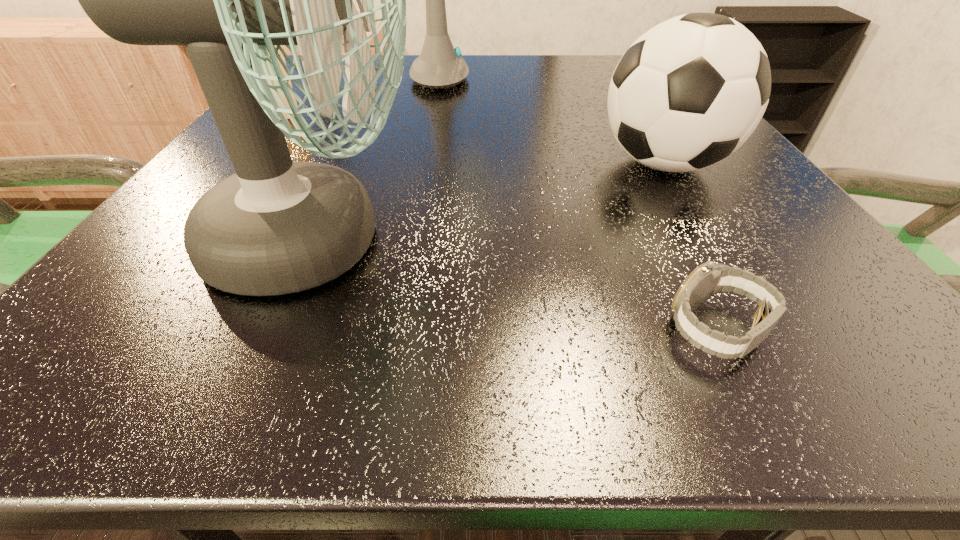
This screenshot has height=540, width=960. Identify the location of object at the near left corner. (276, 227).

Image resolution: width=960 pixels, height=540 pixels. I want to click on object that is at the near right corner, so click(709, 278).

In the image, there is a desktop. At what (x,y) coordinates should I click in order to perform the action: click on vacant space at the far edge. Please return your answer as a coordinate pair (x, y). This screenshot has height=540, width=960. Looking at the image, I should click on (567, 77).

Where is `vacant space at the near edge of the desktop`? vacant space at the near edge of the desktop is located at coordinates (708, 379).

What are the coordinates of `vacant space at the left edge of the desktop` in the screenshot? It's located at (309, 106).

The height and width of the screenshot is (540, 960). In the image, there is a desktop. Identify the location of vacant space at the near left corner. (132, 347).

Locate an element on the screen. This screenshot has width=960, height=540. free space at the near right corner of the desktop is located at coordinates (900, 338).

Find the location of a particular element. The height and width of the screenshot is (540, 960). vacant space that's between the watch and the farthest object is located at coordinates (584, 205).

Locate an element on the screen. vacant area that lies between the shortest object and the fourth nearest object is located at coordinates (501, 222).

I want to click on vacant space that's between the nearer fan and the third tallest object, so click(x=491, y=202).